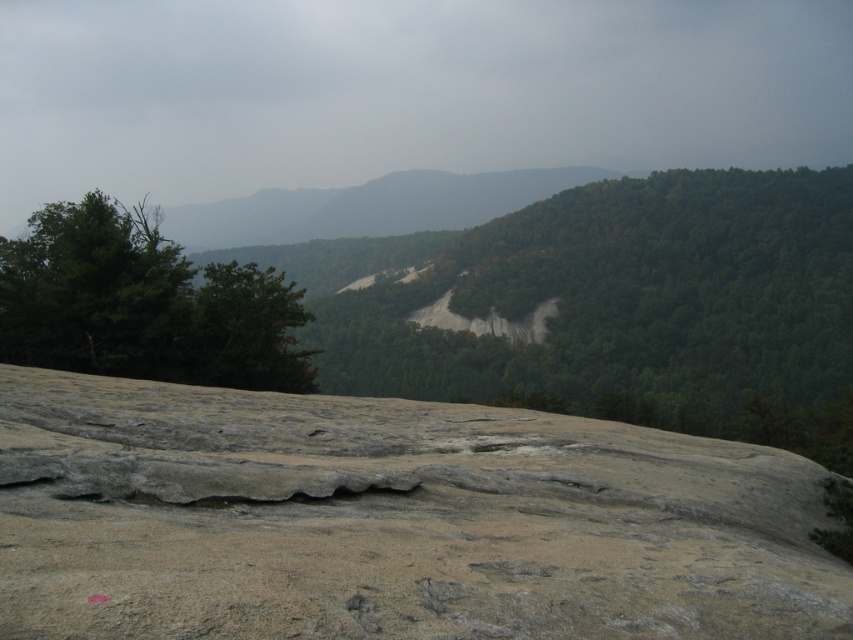
You are a hiker standing at the edge of the rocky foreground in the image. You need to reach the clearing in the midground. Which tree should you use as a landmark to guide you towards the clearing? The green leafy tree at center or the green leafy tree at left?

The green leafy tree at center is taller than the green leafy tree at left. Since the clearing is in the midground, the taller tree at center would be a better landmark to guide you towards the clearing as it stands out more in the landscape.

You are standing at the point marked by the coordinates (x=631, y=310) in the image. Looking around, you see a green leafy tree at center. Which direction should you walk to reach the dense forested area extending into the distance?

Since the point marks the green leafy tree at center, the dense forested area extending into the distance is likely behind you. To reach it, walk forward from the marked point.